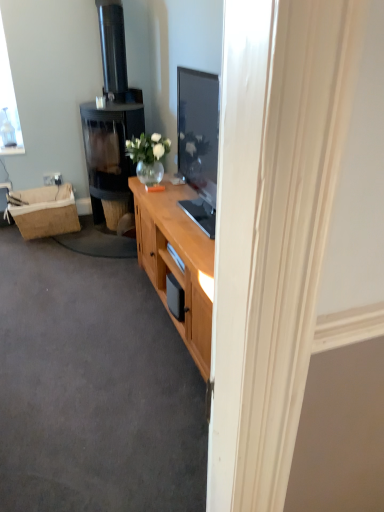
Question: Is black glass fireplace at left taller or shorter than wooden cabinet at center?

Choices:
 (A) short
 (B) tall

Answer: (B)

Question: Relative to wooden cabinet at center, is black glass fireplace at left in front or behind?

Choices:
 (A) front
 (B) behind

Answer: (B)

Question: Considering the real-world distances, which object is farthest from the black glass fireplace at left?

Choices:
 (A) wooden cabinet at center
 (B) burlap picnic basket at left

Answer: (A)

Question: Which object is positioned closest to the black glass fireplace at left?

Choices:
 (A) burlap picnic basket at left
 (B) wooden cabinet at center

Answer: (A)